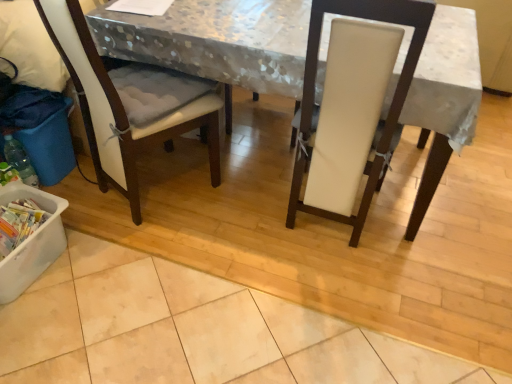
Where is `free spot in front of white fabric-covered table at center`? This screenshot has width=512, height=384. free spot in front of white fabric-covered table at center is located at coordinates (239, 302).